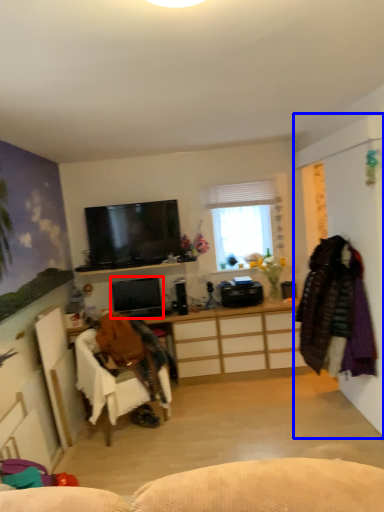
Question: Which point is further to the camera, television (highlighted by a red box) or side (highlighted by a blue box)?

Choices:
 (A) television
 (B) side

Answer: (A)